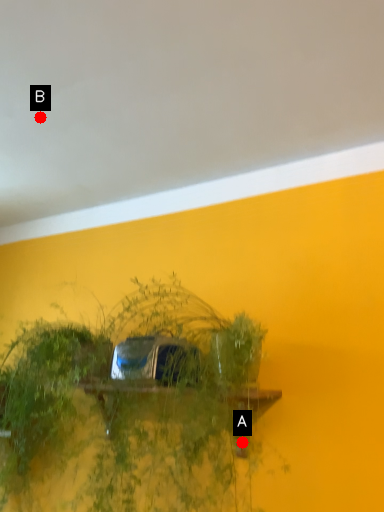
Question: Two points are circled on the image, labeled by A and B beside each circle. Which point is closer to the camera?

Choices:
 (A) A is closer
 (B) B is closer

Answer: (A)